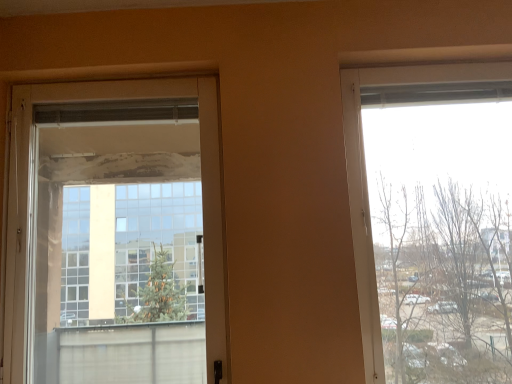
Question: Considering the relative sizes of transparent glass window at right and transparent glass door at left in the image provided, is transparent glass window at right thinner than transparent glass door at left?

Choices:
 (A) no
 (B) yes

Answer: (A)

Question: From the image's perspective, is transparent glass window at right under transparent glass door at left?

Choices:
 (A) no
 (B) yes

Answer: (A)

Question: Are transparent glass window at right and transparent glass door at left located far from each other?

Choices:
 (A) no
 (B) yes

Answer: (A)

Question: Is transparent glass window at right completely or partially outside of transparent glass door at left?

Choices:
 (A) yes
 (B) no

Answer: (A)

Question: Does transparent glass window at right come in front of transparent glass door at left?

Choices:
 (A) no
 (B) yes

Answer: (B)

Question: Can you confirm if transparent glass window at right is positioned to the left of transparent glass door at left?

Choices:
 (A) yes
 (B) no

Answer: (B)

Question: From a real-world perspective, is transparent glass door at left below transparent glass window at right?

Choices:
 (A) yes
 (B) no

Answer: (B)

Question: Considering the relative positions of transparent glass door at left and transparent glass window at right in the image provided, is transparent glass door at left behind transparent glass window at right?

Choices:
 (A) yes
 (B) no

Answer: (A)

Question: Can you confirm if transparent glass door at left is positioned to the left of transparent glass window at right?

Choices:
 (A) no
 (B) yes

Answer: (B)

Question: Is transparent glass door at left oriented towards transparent glass window at right?

Choices:
 (A) no
 (B) yes

Answer: (A)

Question: Is transparent glass door at left smaller than transparent glass window at right?

Choices:
 (A) yes
 (B) no

Answer: (A)

Question: Is the surface of transparent glass door at left in direct contact with transparent glass window at right?

Choices:
 (A) no
 (B) yes

Answer: (A)

Question: Looking at their shapes, would you say transparent glass window at right is wider or thinner than transparent glass door at left?

Choices:
 (A) wide
 (B) thin

Answer: (A)